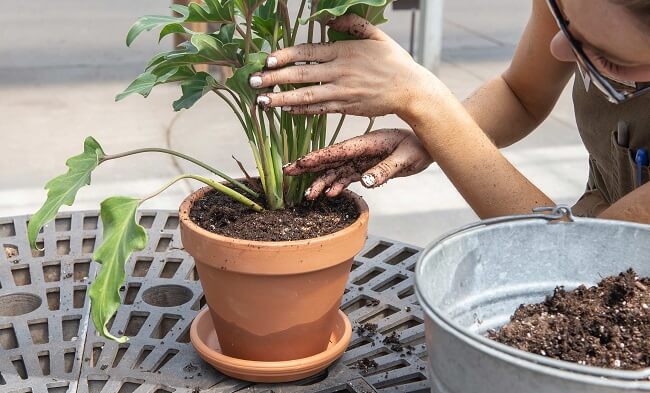
Locate an element on the screen. This screenshot has height=393, width=650. ceramic water plate for plant potter is located at coordinates (285, 372).